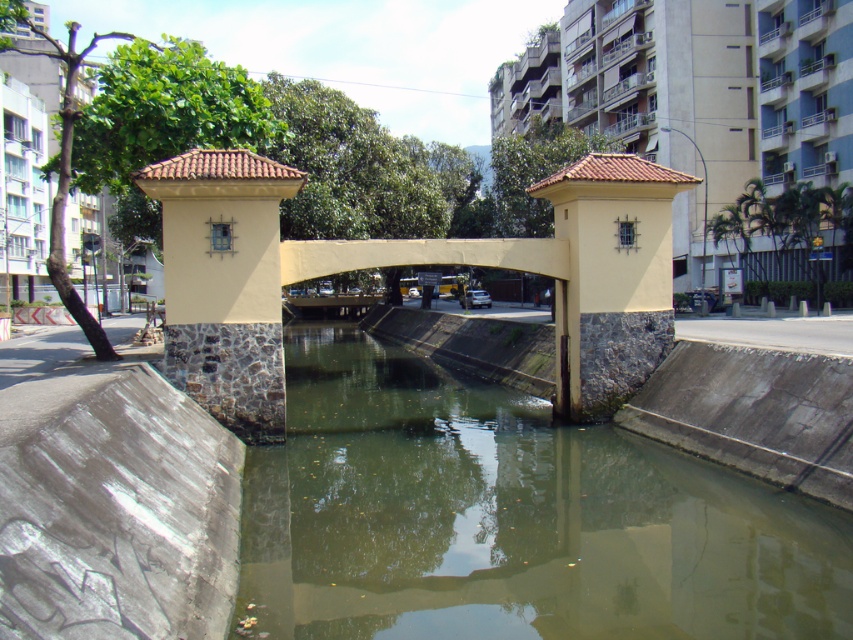
You are standing on the arched bridge and want to locate the greenish concrete water at center. According to the coordinates provided, in which direction should you look to find it?

The greenish concrete water at center is located at coordinates point (508, 518), so you should look downward since the y coordinate is below 0.5, indicating it is below the bridge.

You are a drone operator trying to fly a drone through the space between the matte yellow stone bridge at center and the yellow stone pillar at center. Can the drone pass through this space?

The matte yellow stone bridge at center is above the yellow stone pillar at center, so there is space between them. The drone can pass through the space between the matte yellow stone bridge at center and the yellow stone pillar at center.